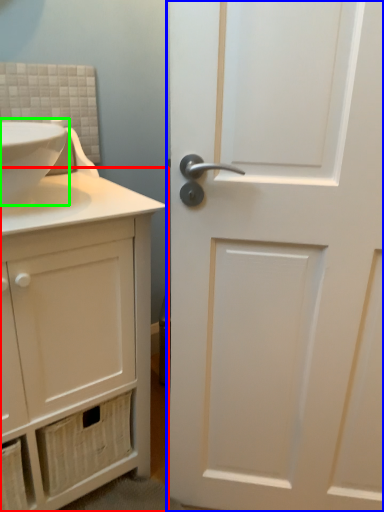
Question: Which object is the closest to the bathroom cabinet (highlighted by a red box)? Choose among these: door (highlighted by a blue box) or sink (highlighted by a green box).

Choices:
 (A) door
 (B) sink

Answer: (A)